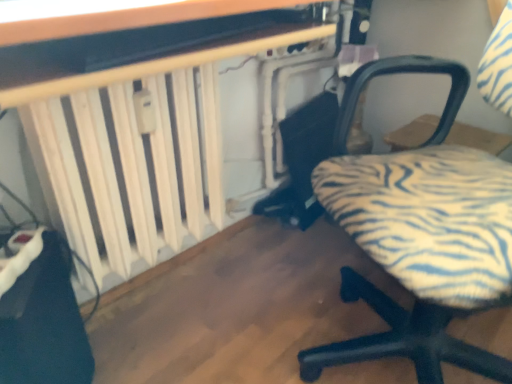
Measure the distance between point (440, 67) and camera.

They are 1.13 meters apart.

The height and width of the screenshot is (384, 512). Find the location of `zebra-patterned fabric chair at lower right`. zebra-patterned fabric chair at lower right is located at coordinates (403, 339).

What is the approximate width of white wooden radiator at left, which is the 2th table in front-to-back order?

white wooden radiator at left, which is the 2th table in front-to-back order, is 7.36 inches wide.

The height and width of the screenshot is (384, 512). I want to click on wooden table at upper center, which is the 2th table from back to front, so click(144, 43).

Image resolution: width=512 pixels, height=384 pixels. I want to click on zebra-patterned fabric chair at lower right, so click(x=403, y=339).

Based on the photo, from the image's perspective, does white wooden radiator at left, which is the 2th table in front-to-back order, appear lower than zebra-patterned fabric chair at lower right?

Incorrect, from the image's perspective, white wooden radiator at left, which is the 2th table in front-to-back order, is higher than zebra-patterned fabric chair at lower right.

Is zebra-patterned fabric chair at lower right a part of white wooden radiator at left, which is the 2th table in front-to-back order?

No, zebra-patterned fabric chair at lower right is not a part of white wooden radiator at left, which is the 2th table in front-to-back order.

Does white wooden radiator at left, which is the 2th table in front-to-back order, turn towards zebra-patterned fabric chair at lower right?

Yes, white wooden radiator at left, which is the 2th table in front-to-back order, is facing zebra-patterned fabric chair at lower right.

From a real-world perspective, is white wooden radiator at left, which is the 2th table in front-to-back order, physically located above or below zebra-patterned fabric chair at lower right?

white wooden radiator at left, which is the 2th table in front-to-back order, is below zebra-patterned fabric chair at lower right.

From the image's perspective, would you say zebra-patterned fabric chair at lower right is positioned over wooden table at upper center, which is the 2th table from back to front?

Incorrect, from the image's perspective, zebra-patterned fabric chair at lower right is lower than wooden table at upper center, which is the 2th table from back to front.

Where is `the 2nd table above the zebra-patterned fabric chair at lower right (from the image's perspective)`? The height and width of the screenshot is (384, 512). the 2nd table above the zebra-patterned fabric chair at lower right (from the image's perspective) is located at coordinates (144, 43).

Which object is wider, zebra-patterned fabric chair at lower right or wooden table at upper center, which is the 2th table from back to front?

zebra-patterned fabric chair at lower right is wider.

Which object is wider, wooden table at upper center, arranged as the first table when viewed from the front, or white wooden radiator at left, which is the 2th table in front-to-back order?

Wider between the two is white wooden radiator at left, which is the 2th table in front-to-back order.

From the image's perspective, is wooden table at upper center, arranged as the first table when viewed from the front, beneath white wooden radiator at left, which is the first table in back-to-front order?

No, from the image's perspective, wooden table at upper center, arranged as the first table when viewed from the front, is not beneath white wooden radiator at left, which is the first table in back-to-front order.

Is wooden table at upper center, which is the 2th table from back to front, aimed at white wooden radiator at left, which is the first table in back-to-front order?

No, wooden table at upper center, which is the 2th table from back to front, is not facing towards white wooden radiator at left, which is the first table in back-to-front order.

From a real-world perspective, between wooden table at upper center, arranged as the first table when viewed from the front, and white wooden radiator at left, which is the 2th table in front-to-back order, who is vertically higher?

In real-world perspective, wooden table at upper center, arranged as the first table when viewed from the front, is above.

Does point (31, 27) lie behind point (415, 62)?

No.

Does wooden table at upper center, which is the 2th table from back to front, have a greater height compared to zebra-patterned fabric chair at lower right?

In fact, wooden table at upper center, which is the 2th table from back to front, may be shorter than zebra-patterned fabric chair at lower right.

Measure the distance from wooden table at upper center, which is the 2th table from back to front, to zebra-patterned fabric chair at lower right.

The distance of wooden table at upper center, which is the 2th table from back to front, from zebra-patterned fabric chair at lower right is 29.93 inches.

Does white wooden radiator at left, which is the first table in back-to-front order, appear on the right side of wooden table at upper center, arranged as the first table when viewed from the front?

No.

Which point is more forward, (132,215) or (118,16)?

The point (118,16) is in front.

From a real-world perspective, does white wooden radiator at left, which is the 2th table in front-to-back order, sit lower than wooden table at upper center, which is the 2th table from back to front?

Yes, from a real-world perspective, white wooden radiator at left, which is the 2th table in front-to-back order, is under wooden table at upper center, which is the 2th table from back to front.

Is wooden table at upper center, arranged as the first table when viewed from the front, at the back of white wooden radiator at left, which is the 2th table in front-to-back order?

white wooden radiator at left, which is the 2th table in front-to-back order, does not have its back to wooden table at upper center, arranged as the first table when viewed from the front.

From the image's perspective, would you say zebra-patterned fabric chair at lower right is shown under white wooden radiator at left, which is the first table in back-to-front order?

Yes, from the image's perspective, zebra-patterned fabric chair at lower right is beneath white wooden radiator at left, which is the first table in back-to-front order.

Does zebra-patterned fabric chair at lower right appear on the right side of white wooden radiator at left, which is the first table in back-to-front order?

Yes, zebra-patterned fabric chair at lower right is to the right of white wooden radiator at left, which is the first table in back-to-front order.

Can you confirm if zebra-patterned fabric chair at lower right is wider than white wooden radiator at left, which is the 2th table in front-to-back order?

Yes.

Which is closer, (425, 314) or (139, 220)?

Positioned in front is point (425, 314).

Locate an element on the screen. The height and width of the screenshot is (384, 512). chair below the white wooden radiator at left, which is the first table in back-to-front order (from the image's perspective) is located at coordinates (403, 339).

From the image's perspective, starting from the zebra-patterned fabric chair at lower right, which table is the 2nd one above? Please provide its 2D coordinates.

[(144, 43)]

When comparing their distances from white wooden radiator at left, which is the 2th table in front-to-back order, does wooden table at upper center, arranged as the first table when viewed from the front, or zebra-patterned fabric chair at lower right seem closer?

The object closer to white wooden radiator at left, which is the 2th table in front-to-back order, is wooden table at upper center, arranged as the first table when viewed from the front.

Considering their positions, is white wooden radiator at left, which is the 2th table in front-to-back order, positioned closer to wooden table at upper center, arranged as the first table when viewed from the front, than zebra-patterned fabric chair at lower right?

white wooden radiator at left, which is the 2th table in front-to-back order, lies closer to wooden table at upper center, arranged as the first table when viewed from the front, than the other object.

Looking at the image, which one is located closer to white wooden radiator at left, which is the 2th table in front-to-back order, zebra-patterned fabric chair at lower right or wooden table at upper center, which is the 2th table from back to front?

Among the two, wooden table at upper center, which is the 2th table from back to front, is located nearer to white wooden radiator at left, which is the 2th table in front-to-back order.

Looking at the image, which one is located closer to zebra-patterned fabric chair at lower right, wooden table at upper center, which is the 2th table from back to front, or white wooden radiator at left, which is the 2th table in front-to-back order?

white wooden radiator at left, which is the 2th table in front-to-back order, is positioned closer to the anchor zebra-patterned fabric chair at lower right.

From the image, which object appears to be farther from wooden table at upper center, which is the 2th table from back to front, zebra-patterned fabric chair at lower right or white wooden radiator at left, which is the first table in back-to-front order?

Among the two, zebra-patterned fabric chair at lower right is located further to wooden table at upper center, which is the 2th table from back to front.

When comparing their distances from zebra-patterned fabric chair at lower right, does white wooden radiator at left, which is the 2th table in front-to-back order, or wooden table at upper center, which is the 2th table from back to front, seem closer?

white wooden radiator at left, which is the 2th table in front-to-back order, is positioned closer to the anchor zebra-patterned fabric chair at lower right.

This screenshot has width=512, height=384. Find the location of `table situated between white wooden radiator at left, which is the 2th table in front-to-back order, and zebra-patterned fabric chair at lower right from left to right`. table situated between white wooden radiator at left, which is the 2th table in front-to-back order, and zebra-patterned fabric chair at lower right from left to right is located at coordinates (144, 43).